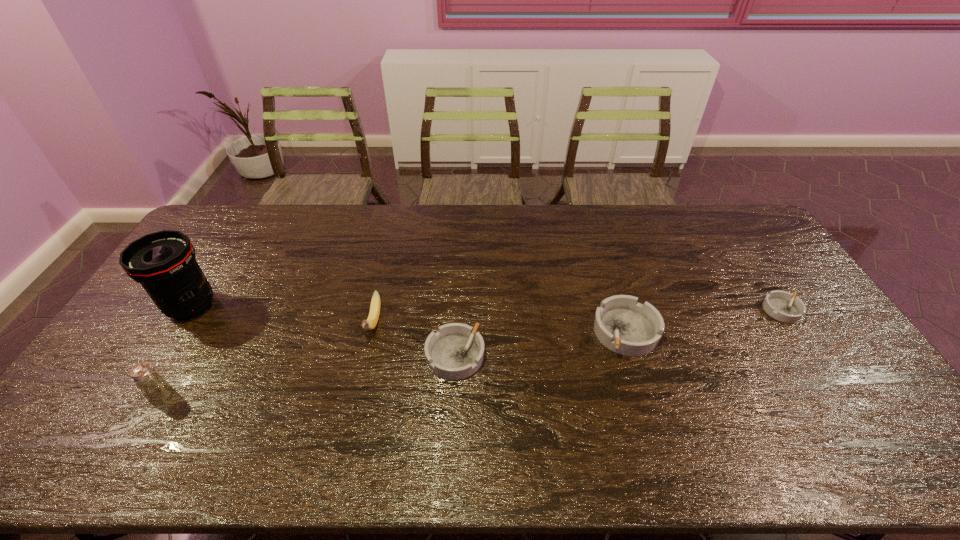
What are the coordinates of `the fourth object from left to right` in the screenshot? It's located at (456, 351).

Locate an element on the screen. Image resolution: width=960 pixels, height=540 pixels. the second tallest ashtray is located at coordinates (456, 351).

Where is `the second ashtray from left to right`? the second ashtray from left to right is located at coordinates (623, 325).

Where is `the rightmost object`? The image size is (960, 540). the rightmost object is located at coordinates (781, 305).

Identify the location of the shortest object. (781, 305).

The width and height of the screenshot is (960, 540). Find the location of `the tallest object`. the tallest object is located at coordinates (164, 263).

Locate an element on the screen. This screenshot has height=540, width=960. banana is located at coordinates (371, 322).

The height and width of the screenshot is (540, 960). I want to click on the fourth object from right to left, so click(371, 322).

This screenshot has height=540, width=960. Identify the location of the second tallest object. (155, 389).

At what (x,y) coordinates should I click in order to perform the action: click on the nearest object. Please return your answer as a coordinate pair (x, y). This screenshot has width=960, height=540. Looking at the image, I should click on (155, 389).